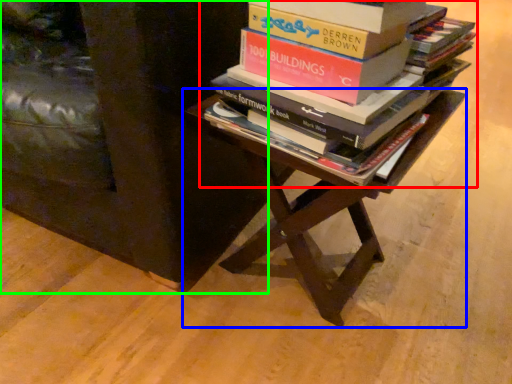
Question: Which is farther away from book (highlighted by a red box)? table (highlighted by a blue box) or furniture (highlighted by a green box)?

Choices:
 (A) table
 (B) furniture

Answer: (B)